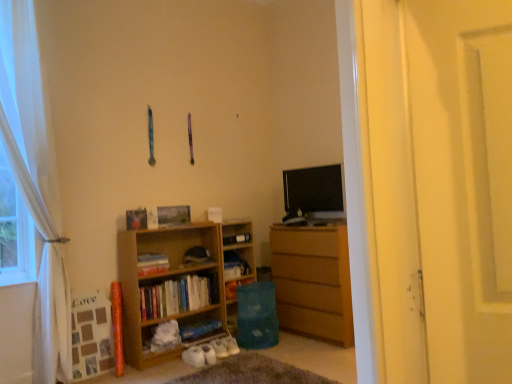
Question: Does blue matte book at lower center, arranged as the fourth book when viewed from the top, lie behind white sheer curtain at left?

Choices:
 (A) yes
 (B) no

Answer: (A)

Question: Is blue matte book at lower center, acting as the first book starting from the bottom, outside white sheer curtain at left?

Choices:
 (A) no
 (B) yes

Answer: (B)

Question: Is blue matte book at lower center, arranged as the fourth book when viewed from the top, wider than white sheer curtain at left?

Choices:
 (A) no
 (B) yes

Answer: (B)

Question: Can white sheer curtain at left be found inside blue matte book at lower center, acting as the first book starting from the bottom?

Choices:
 (A) yes
 (B) no

Answer: (B)

Question: From a real-world perspective, is blue matte book at lower center, acting as the first book starting from the bottom, located higher than white sheer curtain at left?

Choices:
 (A) yes
 (B) no

Answer: (B)

Question: Does point (227, 256) appear closer or farther from the camera than point (162, 309)?

Choices:
 (A) farther
 (B) closer

Answer: (A)

Question: Would you say wooden bookshelf at center is inside or outside wooden bookshelf at center, the 3th book positioned from the top?

Choices:
 (A) inside
 (B) outside

Answer: (B)

Question: Is wooden bookshelf at center to the left or to the right of wooden bookshelf at center, the 3th book positioned from the top, in the image?

Choices:
 (A) right
 (B) left

Answer: (A)

Question: From the image's perspective, is wooden bookshelf at center above or below wooden bookshelf at center, the 3th book positioned from the top?

Choices:
 (A) below
 (B) above

Answer: (B)

Question: Do you think white sheer curtain at left is within wooden bookshelf at center, or outside of it?

Choices:
 (A) inside
 (B) outside

Answer: (B)

Question: Relative to wooden bookshelf at center, is white sheer curtain at left in front or behind?

Choices:
 (A) front
 (B) behind

Answer: (A)

Question: From the image's perspective, relative to wooden bookshelf at center, is white sheer curtain at left above or below?

Choices:
 (A) above
 (B) below

Answer: (A)

Question: Considering the positions of white sheer curtain at left and wooden bookshelf at center in the image, is white sheer curtain at left wider or thinner than wooden bookshelf at center?

Choices:
 (A) thin
 (B) wide

Answer: (A)

Question: From the image's perspective, is wooden chest of drawers at right positioned above or below wooden bookshelf at center, the 2th book when ordered from bottom to top?

Choices:
 (A) below
 (B) above

Answer: (B)

Question: Looking at their shapes, would you say wooden chest of drawers at right is wider or thinner than wooden bookshelf at center, the 3th book positioned from the top?

Choices:
 (A) wide
 (B) thin

Answer: (A)